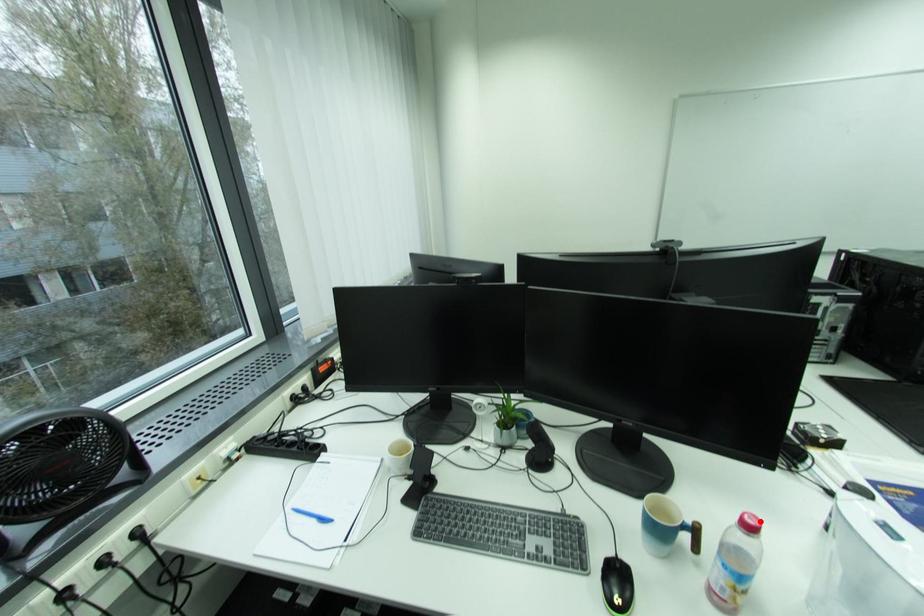
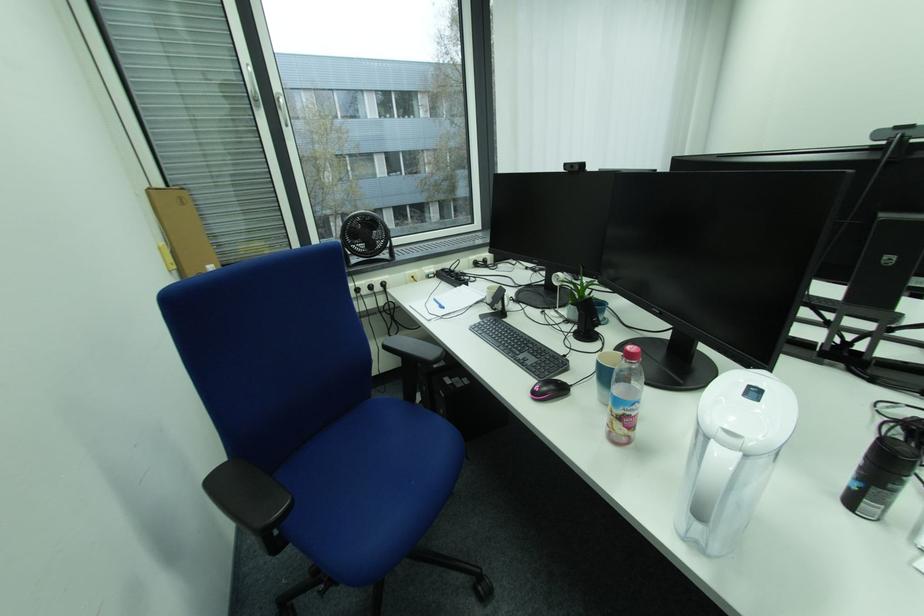
Locate, in the second image, the point that corresponds to the highlighted location in the first image.

(638, 350)